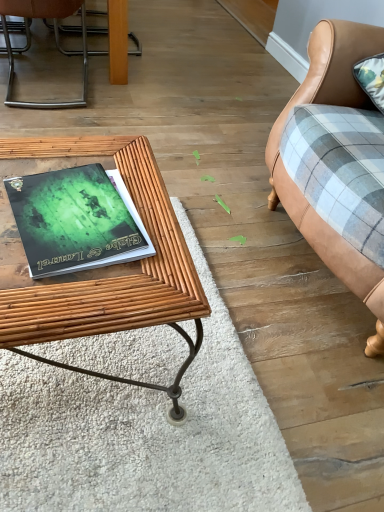
Image resolution: width=384 pixels, height=512 pixels. Find the location of `free space underneath metallic silver chair at upper left (from a real-world perspective)`. free space underneath metallic silver chair at upper left (from a real-world perspective) is located at coordinates (52, 94).